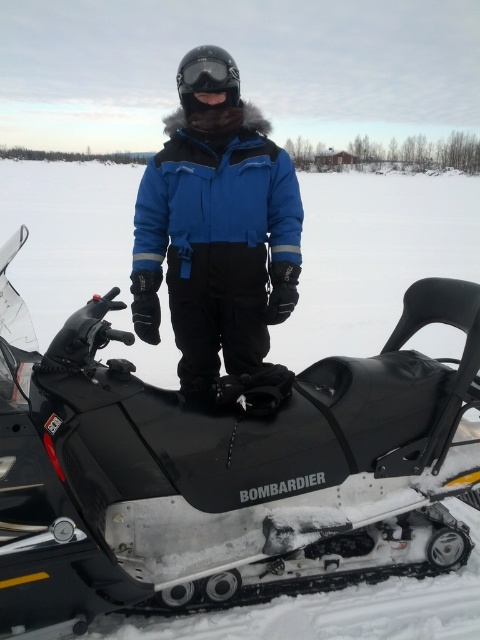
Is blue synthetic jacket at center bigger than black matte goggles at center?

Incorrect, blue synthetic jacket at center is not larger than black matte goggles at center.

Measure the distance between blue synthetic jacket at center and black matte goggles at center.

blue synthetic jacket at center and black matte goggles at center are 1.15 meters apart from each other.

Find the location of a particular element. blue synthetic jacket at center is located at coordinates (216, 240).

Identify the location of blue synthetic jacket at center. (216, 240).

Is point (95, 417) closer to viewer compared to point (251, 168)?

Yes.

Is point (424, 472) in front of point (173, 285)?

That is True.

The height and width of the screenshot is (640, 480). In order to click on black matte snowmobile at center in this screenshot , I will do `click(224, 470)`.

Which of these two, black matte snowmobile at center or black matte goggles at center, stands taller?

With more height is black matte goggles at center.

Does black matte snowmobile at center appear over black matte goggles at center?

Actually, black matte snowmobile at center is below black matte goggles at center.

This screenshot has width=480, height=640. What do you see at coordinates (224, 470) in the screenshot? I see `black matte snowmobile at center` at bounding box center [224, 470].

This screenshot has width=480, height=640. Find the location of `black matte snowmobile at center`. black matte snowmobile at center is located at coordinates (224, 470).